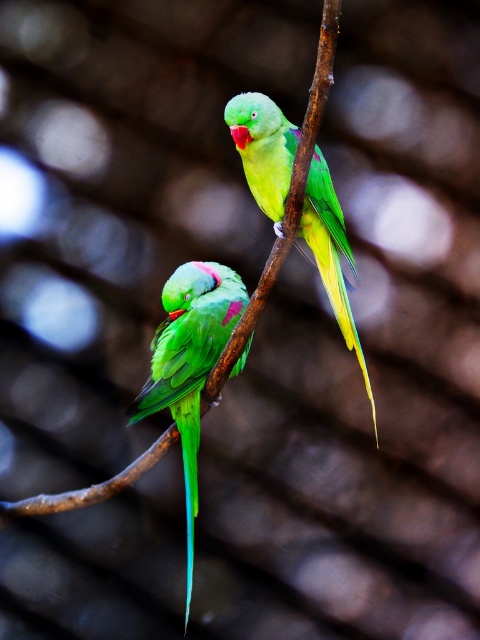
Question: Is matte green parrot at center bigger than green glossy parrot at center?

Choices:
 (A) no
 (B) yes

Answer: (A)

Question: Is matte green parrot at center further to camera compared to green glossy parrot at center?

Choices:
 (A) yes
 (B) no

Answer: (A)

Question: Considering the relative positions of matte green parrot at center and green glossy parrot at center in the image provided, where is matte green parrot at center located with respect to green glossy parrot at center?

Choices:
 (A) below
 (B) above

Answer: (A)

Question: Which point is closer to the camera taking this photo?

Choices:
 (A) (319, 189)
 (B) (131, 412)

Answer: (A)